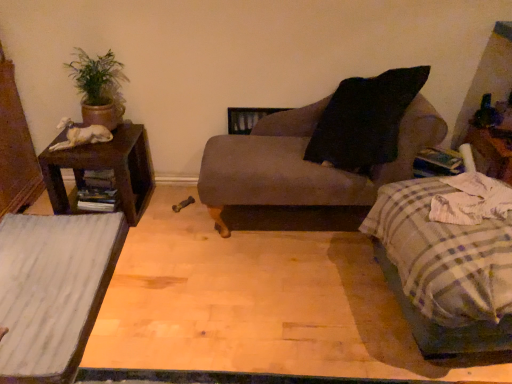
Where is `vacant area that lies in front of matte gray chaise at center`? The height and width of the screenshot is (384, 512). vacant area that lies in front of matte gray chaise at center is located at coordinates (275, 297).